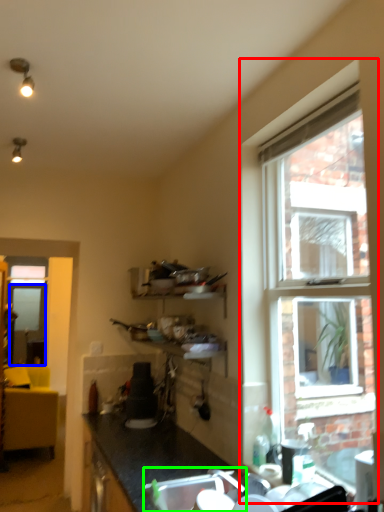
Question: Considering the real-world distances, which object is farthest from window (highlighted by a red box)? screen door (highlighted by a blue box) or sink (highlighted by a green box)?

Choices:
 (A) screen door
 (B) sink

Answer: (A)